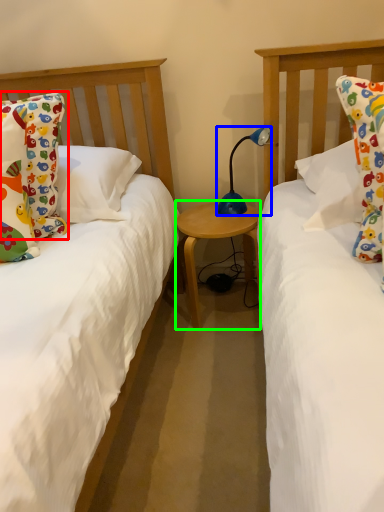
Question: Estimate the real-world distances between objects in this image. Which object is farther from pillow (highlighted by a red box), lamp (highlighted by a blue box) or table (highlighted by a green box)?

Choices:
 (A) lamp
 (B) table

Answer: (A)